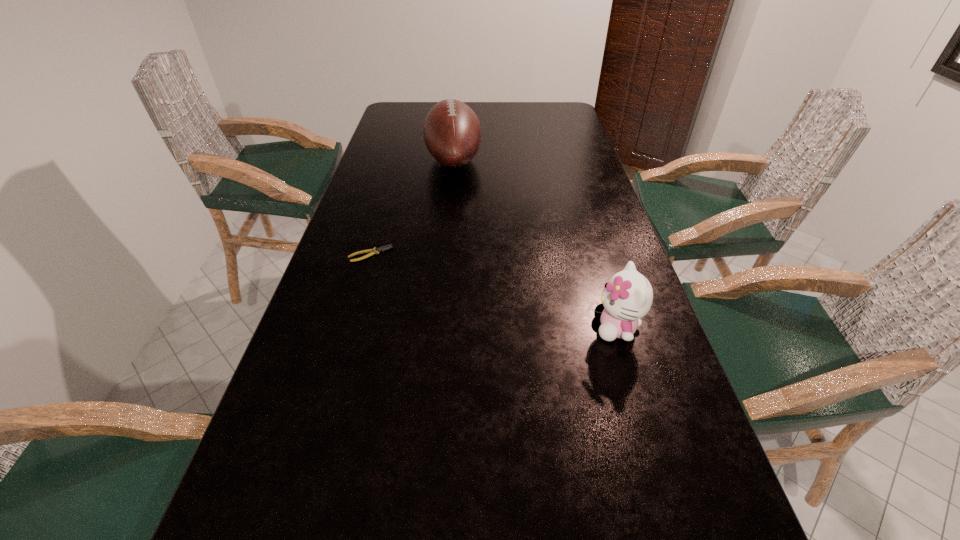
Identify the location of the farthest object. This screenshot has width=960, height=540. (452, 133).

In order to click on football (American) in this screenshot , I will do click(x=452, y=133).

Image resolution: width=960 pixels, height=540 pixels. Find the location of `kitten`. kitten is located at coordinates (627, 297).

Locate an element on the screen. The width and height of the screenshot is (960, 540). the rightmost object is located at coordinates (627, 297).

Locate an element on the screen. The width and height of the screenshot is (960, 540). the second nearest object is located at coordinates (375, 250).

Identify the location of the leftmost object. [375, 250].

This screenshot has height=540, width=960. In order to click on vacant space located on the right of the farthest object in this screenshot , I will do `click(549, 159)`.

The height and width of the screenshot is (540, 960). Find the location of `blank area located on the front-facing side of the rightmost object`. blank area located on the front-facing side of the rightmost object is located at coordinates (551, 327).

I want to click on free region located on the front-facing side of the rightmost object, so click(565, 327).

Where is `blank space located 0.290m on the front-facing side of the rightmost object`? Image resolution: width=960 pixels, height=540 pixels. blank space located 0.290m on the front-facing side of the rightmost object is located at coordinates (457, 327).